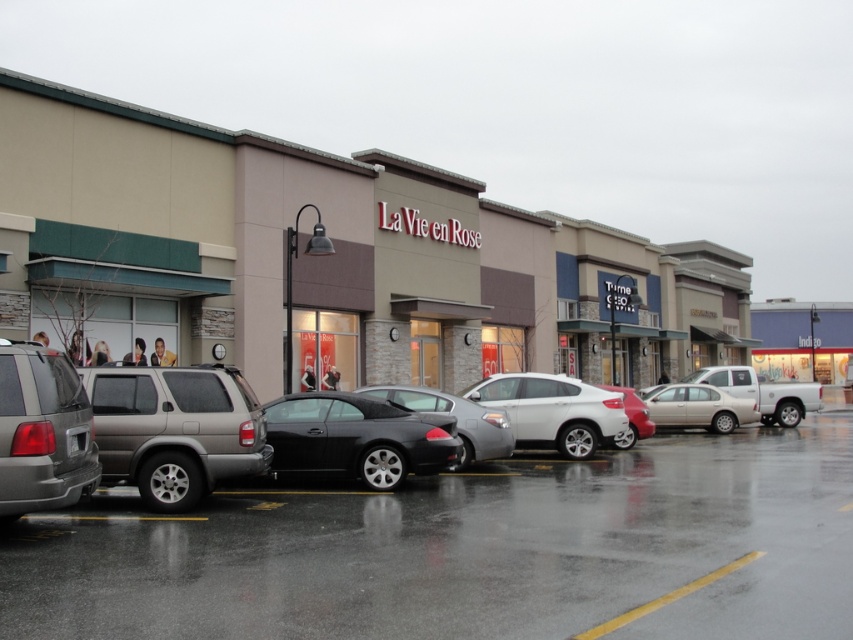
You are a pedestrian standing at the edge of the parking lot. You see the matte beige mall at center and the shiny metallic car at center. Which object is closer to you?

The matte beige mall at center is closer to you because the shiny metallic car at center is behind it.

You are standing in the parking lot of the commercial area and see two points marked on the ground. The first point is at coordinate point (807,305) and the second point is at coordinate point (694,492). Which point is closer to you?

Point (807,305) is closer to you because it is further to the viewer than point (694,492).